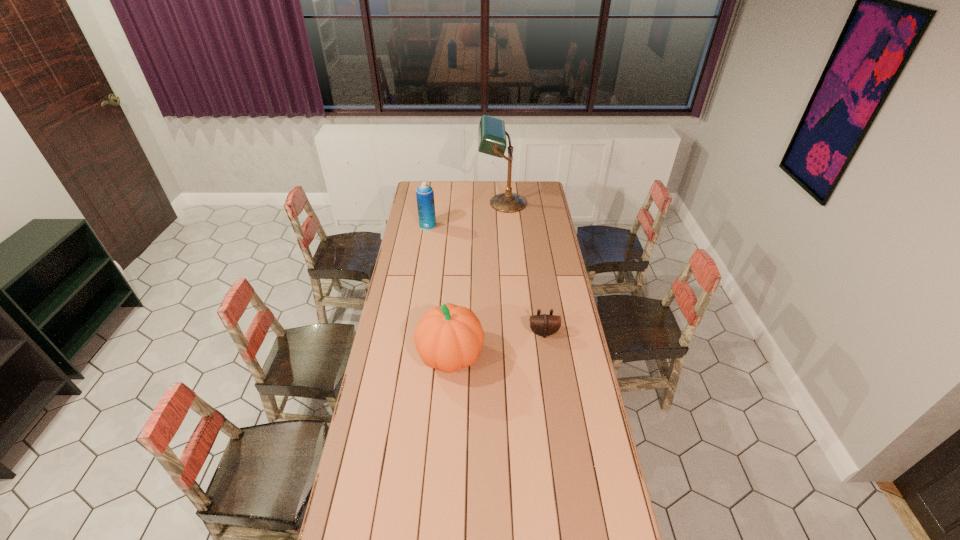
I want to click on free space between the table lamp and the aerosol can, so click(x=465, y=214).

The image size is (960, 540). Identify the location of object that is the second closest to the pumpkin. (424, 193).

Locate which object ranks in proximity to the pouch. Please provide its 2D coordinates. Your answer should be formatted as a tuple, i.e. [(x, y)], where the tuple contains the x and y coordinates of a point satisfying the conditions above.

[(450, 337)]

The width and height of the screenshot is (960, 540). I want to click on vacant space that satisfies the following two spatial constraints: 1. on the front side of the pumpkin; 2. on the left side of the aerosol can, so click(x=407, y=356).

Where is `blank area in the image that satisfies the following two spatial constraints: 1. on the front side of the pumpkin; 2. on the right side of the aerosol can`? The width and height of the screenshot is (960, 540). blank area in the image that satisfies the following two spatial constraints: 1. on the front side of the pumpkin; 2. on the right side of the aerosol can is located at coordinates (407, 356).